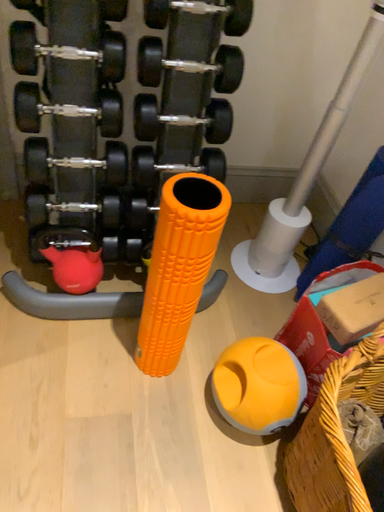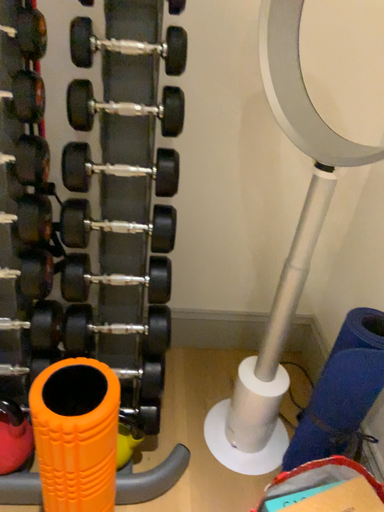
Question: Which way did the camera rotate in the video?

Choices:
 (A) rotated upward
 (B) rotated downward

Answer: (A)